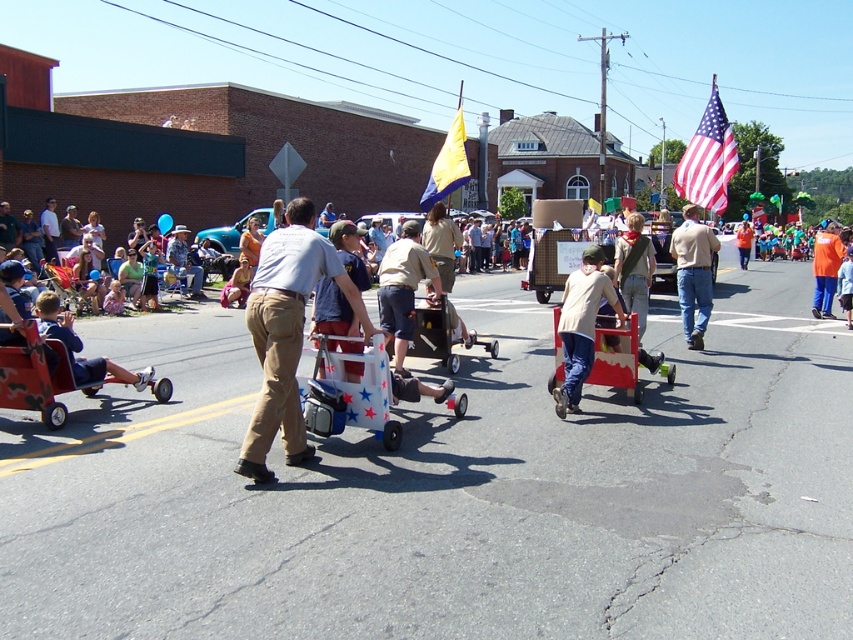
Question: Which point is farther to the camera?

Choices:
 (A) american flag at upper right
 (B) matte blue shirt at left
 (C) denim jeans at center
 (D) camouflage fabric wagon at lower left

Answer: (A)

Question: Can you confirm if khaki pants at center is wider than american flag at upper right?

Choices:
 (A) yes
 (B) no

Answer: (B)

Question: Which point is farther to the camera?

Choices:
 (A) denim jeans at center
 (B) light brown pants at center
 (C) khaki pants at center

Answer: (B)

Question: Can you confirm if light brown fabric shirt at center is thinner than light brown pants at center?

Choices:
 (A) no
 (B) yes

Answer: (B)

Question: Which object is positioned closest to the camouflage fabric wagon at lower left?

Choices:
 (A) yellow fabric flag at center
 (B) matte blue shirt at left

Answer: (B)

Question: Can you confirm if american flag at upper right is positioned to the left of matte blue shirt at left?

Choices:
 (A) no
 (B) yes

Answer: (A)